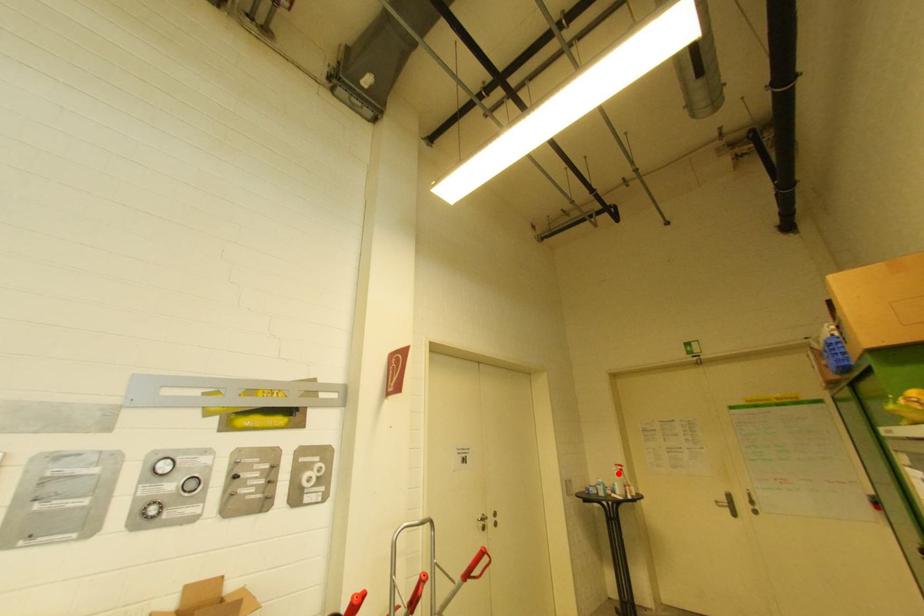
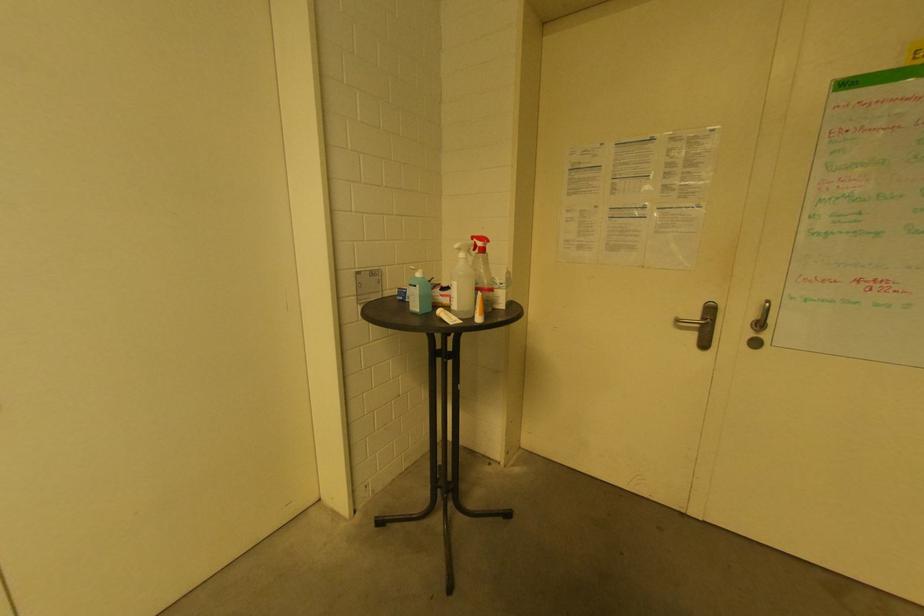
The point at the highlighted location is marked in the first image. Where is the corresponding point in the second image?

(464, 256)